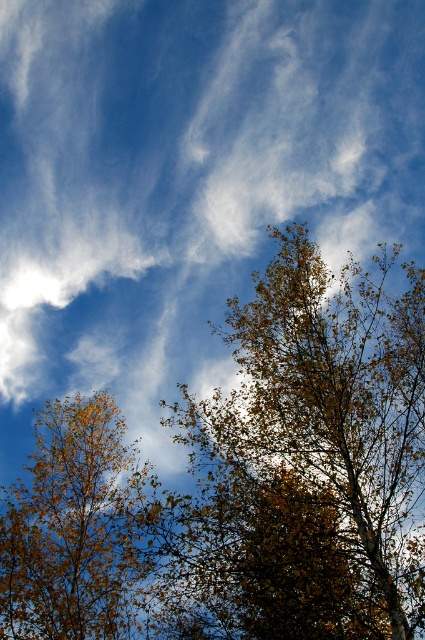
Can you confirm if brown leafy tree at center is positioned to the left of golden-brown leaves at left?

No, brown leafy tree at center is not to the left of golden-brown leaves at left.

Identify the location of brown leafy tree at center. This screenshot has width=425, height=640. (308, 461).